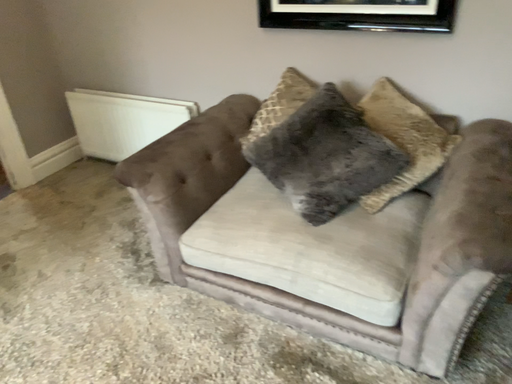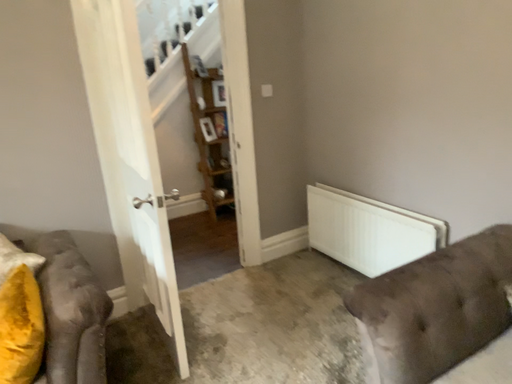
Question: How did the camera likely rotate when shooting the video?

Choices:
 (A) rotated left
 (B) rotated right

Answer: (A)